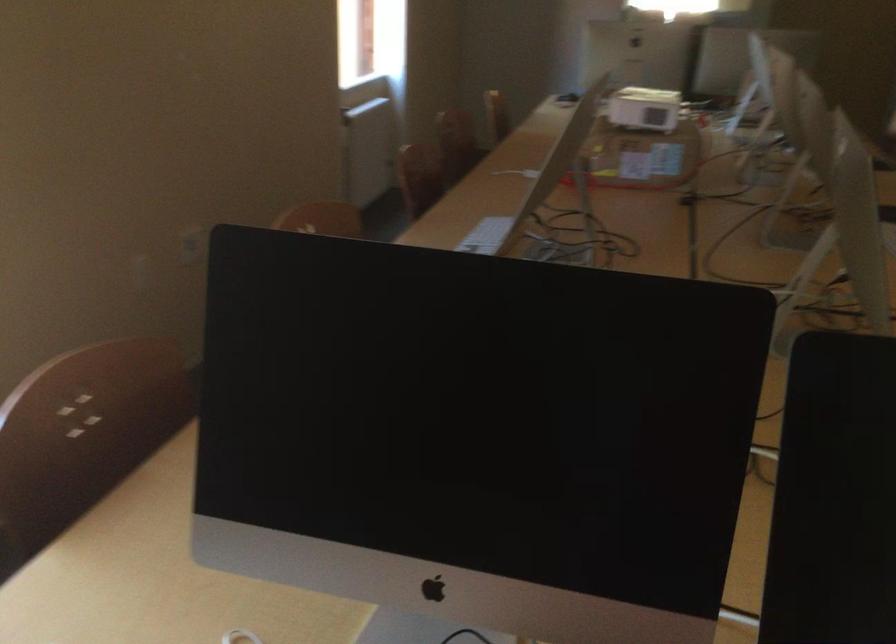
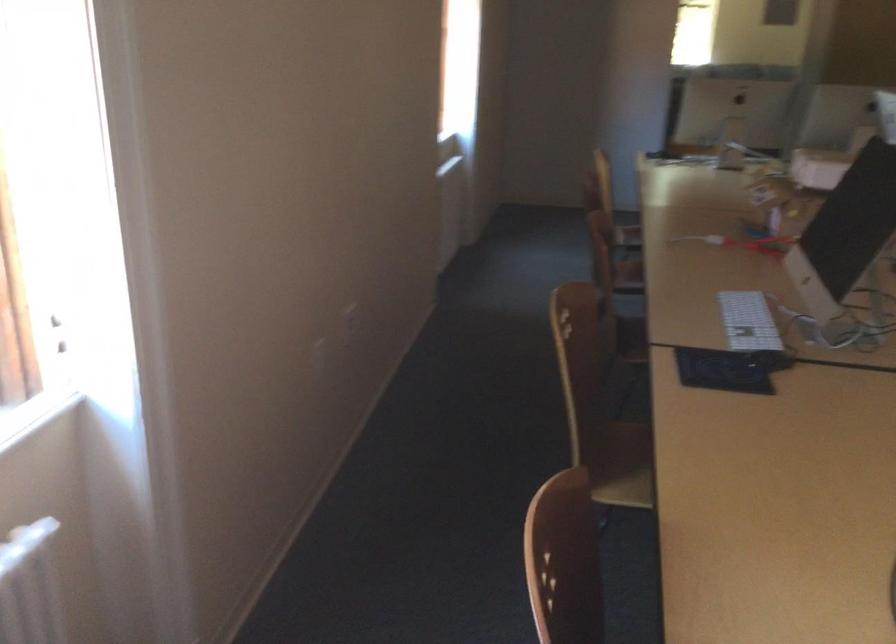
Question: The camera is either moving clockwise (left) or counter-clockwise (right) around the object. The first image is from the beginning of the video and the second image is from the end. Is the camera moving left or right when shooting the video?

Choices:
 (A) Left
 (B) Right

Answer: (A)